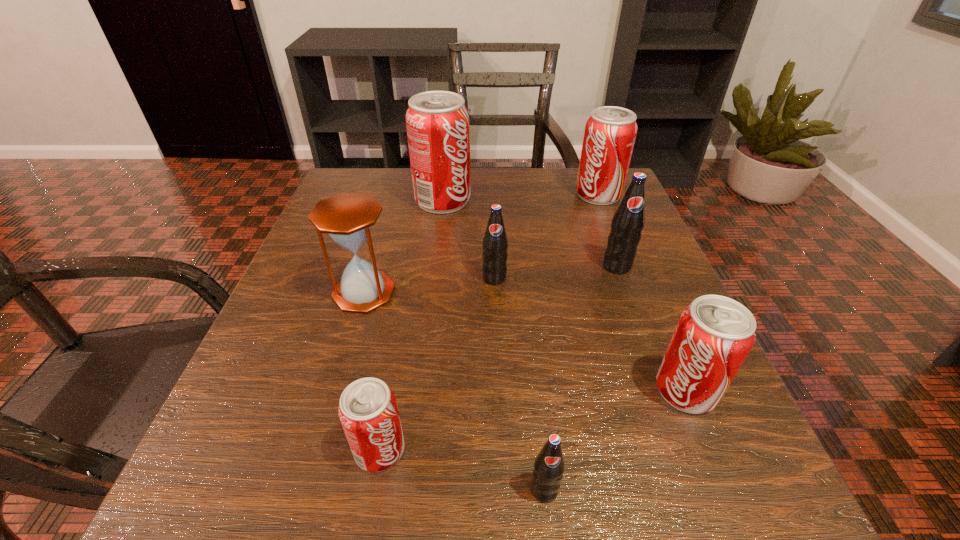
Find the location of a particular element. This screenshot has width=960, height=540. the nearest red soda can is located at coordinates (368, 411).

Find the location of `the fourth object from right to left`. the fourth object from right to left is located at coordinates (549, 466).

You are a GUI agent. You are given a task and a screenshot of the screen. Output one action in this format:
    pyautogui.click(x=<x>, y=<y>)
    Task: Click on the fourth pop from right to left
    This screenshot has height=540, width=960.
    Given the screenshot: What is the action you would take?
    pyautogui.click(x=549, y=466)

Image resolution: width=960 pixels, height=540 pixels. What are the coordinates of `free space located on the front of the biggest red soda can` in the screenshot? It's located at (431, 296).

At what (x,y) coordinates should I click in order to perform the action: click on vacant space located 0.080m on the front of the third smallest red soda can. Please return your answer as a coordinate pair (x, y). Looking at the image, I should click on (611, 227).

This screenshot has width=960, height=540. In order to click on blank space located 0.060m on the front label of the rightmost black pop in this screenshot , I will do `click(629, 297)`.

I want to click on vacant area located 0.070m on the front of the hourglass, so click(x=348, y=346).

Identify the location of vacant area situated on the front label of the second biggest black pop. (497, 355).

You are a GUI agent. You are given a task and a screenshot of the screen. Output one action in this format:
    pyautogui.click(x=<x>, y=<y>)
    Task: Click on the vacant region located 0.180m on the back of the third biggest red soda can
    This screenshot has width=960, height=540.
    Given the screenshot: What is the action you would take?
    pyautogui.click(x=643, y=287)

Where is `vacant space situated on the left of the second nearest object`? vacant space situated on the left of the second nearest object is located at coordinates (207, 450).